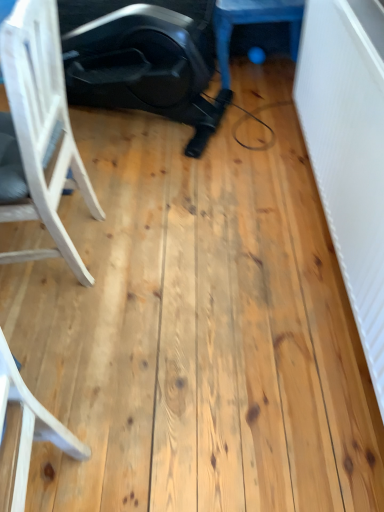
The image size is (384, 512). What do you see at coordinates (253, 23) in the screenshot? I see `blue rubber ball at upper center` at bounding box center [253, 23].

Locate an element on the screen. This screenshot has width=384, height=512. blue rubber ball at upper center is located at coordinates (253, 23).

Consider the image. In order to face blue rubber ball at upper center, should I rotate leftwards or rightwards?

Turn right approximately 9.392 degrees to face it.

The height and width of the screenshot is (512, 384). Describe the element at coordinates (38, 133) in the screenshot. I see `white wood chair at left` at that location.

You are a GUI agent. You are given a task and a screenshot of the screen. Output one action in this format:
    pyautogui.click(x=<x>, y=<y>)
    Task: Click on the white wood chair at left
    
    Given the screenshot: What is the action you would take?
    (38, 133)

What are the coordinates of `blue rubber ball at upper center` in the screenshot? It's located at (253, 23).

Which is more to the left, blue rubber ball at upper center or white wood chair at left?

white wood chair at left is more to the left.

Looking at this image, does blue rubber ball at upper center come behind white wood chair at left?

Yes, the depth of blue rubber ball at upper center is greater than that of white wood chair at left.

Which is farther from the camera, (291, 8) or (58, 119)?

Point (291, 8)

From the image's perspective, would you say blue rubber ball at upper center is positioned over white wood chair at left?

Yes.

From a real-world perspective, which is physically above, blue rubber ball at upper center or white wood chair at left?

white wood chair at left is physically above.

In the scene shown: Which object is thinner, blue rubber ball at upper center or white wood chair at left?

white wood chair at left.

Between blue rubber ball at upper center and white wood chair at left, which one has more height?

white wood chair at left.

Is blue rubber ball at upper center smaller than white wood chair at left?

Yes.

Would you say blue rubber ball at upper center contains white wood chair at left?

No, white wood chair at left is located outside of blue rubber ball at upper center.

Can you see blue rubber ball at upper center touching white wood chair at left?

They are not placed beside each other.

From the picture: Is blue rubber ball at upper center oriented towards white wood chair at left?

No, blue rubber ball at upper center is not aimed at white wood chair at left.

What's the angular difference between blue rubber ball at upper center and white wood chair at left's facing directions?

The facing directions of blue rubber ball at upper center and white wood chair at left are 0.0416 degrees apart.

Image resolution: width=384 pixels, height=512 pixels. I want to click on furniture lying behind the white wood chair at left, so click(x=253, y=23).

Which object is positioned more to the left, white wood chair at left or blue rubber ball at upper center?

white wood chair at left is more to the left.

Is white wood chair at left behind blue rubber ball at upper center?

No, white wood chair at left is closer to the camera.

Based on the photo, which point is more forward, (49, 156) or (280, 9)?

The point (49, 156) is closer.

From the image's perspective, which is above, white wood chair at left or blue rubber ball at upper center?

→ blue rubber ball at upper center is shown above in the image.

From a real-world perspective, between white wood chair at left and blue rubber ball at upper center, who is vertically lower?

blue rubber ball at upper center, from a real-world perspective.

In the scene shown: Is white wood chair at left wider than blue rubber ball at upper center?

No.

Considering the relative sizes of white wood chair at left and blue rubber ball at upper center in the image provided, is white wood chair at left shorter than blue rubber ball at upper center?

No, white wood chair at left is not shorter than blue rubber ball at upper center.

Considering the relative sizes of white wood chair at left and blue rubber ball at upper center in the image provided, is white wood chair at left bigger than blue rubber ball at upper center?

Correct, white wood chair at left is larger in size than blue rubber ball at upper center.

Is blue rubber ball at upper center a part of white wood chair at left?

Actually, blue rubber ball at upper center is outside white wood chair at left.

Is white wood chair at left positioned far away from blue rubber ball at upper center?

Yes, white wood chair at left is far from blue rubber ball at upper center.

Could you tell me if white wood chair at left is facing blue rubber ball at upper center?

No, white wood chair at left is not turned towards blue rubber ball at upper center.

How distant is white wood chair at left from blue rubber ball at upper center?

4.09 feet.

What are the coordinates of `furniture on the right of white wood chair at left` in the screenshot? It's located at (253, 23).

You are a GUI agent. You are given a task and a screenshot of the screen. Output one action in this format:
    pyautogui.click(x=<x>, y=<y>)
    Task: Click on the chair located in front of the blue rubber ball at upper center
    This screenshot has height=512, width=384.
    Given the screenshot: What is the action you would take?
    pyautogui.click(x=38, y=133)

This screenshot has width=384, height=512. In the image, there is a blue rubber ball at upper center. Identify the location of chair below it (from the image's perspective). (38, 133).